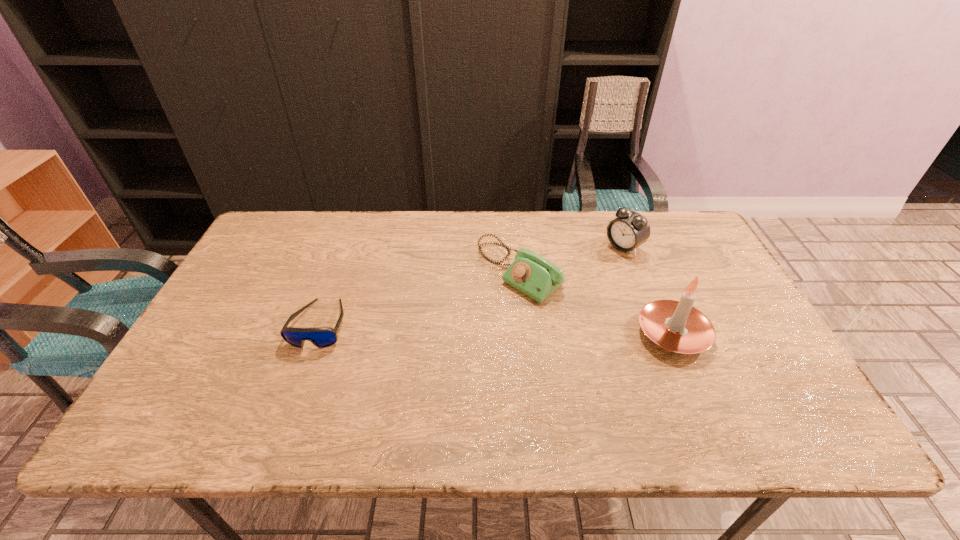
Find the location of `free spot on the desktop that is between the sunglasses and the tallest object and is positioned on the front side of the second tallest object`. free spot on the desktop that is between the sunglasses and the tallest object and is positioned on the front side of the second tallest object is located at coordinates (510, 329).

This screenshot has width=960, height=540. I want to click on free space on the desktop that is between the sunglasses and the candle and is positioned on the dial of the second object from left to right, so [x=444, y=328].